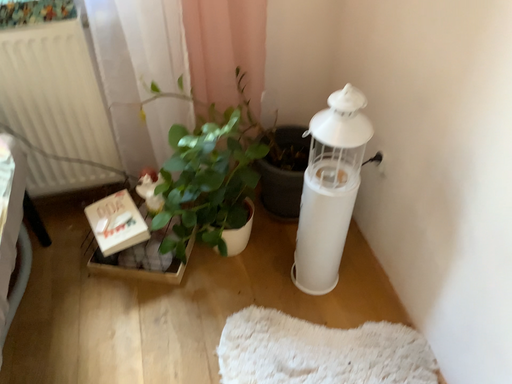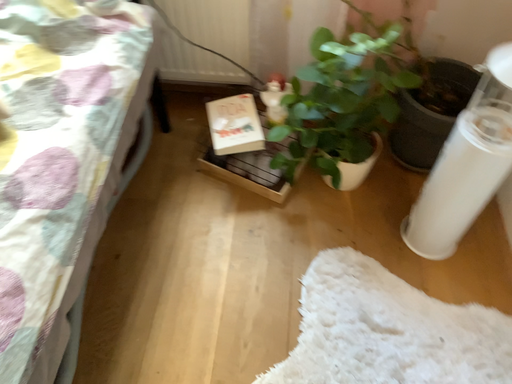
Question: Which way did the camera rotate in the video?

Choices:
 (A) rotated right
 (B) rotated left

Answer: (B)